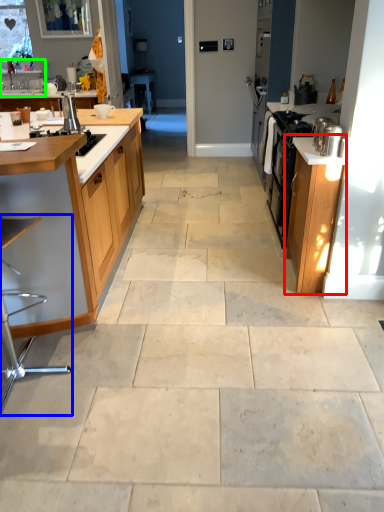
Question: Estimate the real-world distances between objects in this image. Which object is closer to cabinetry (highlighted by a red box), bar stool (highlighted by a blue box) or sink (highlighted by a green box)?

Choices:
 (A) bar stool
 (B) sink

Answer: (A)